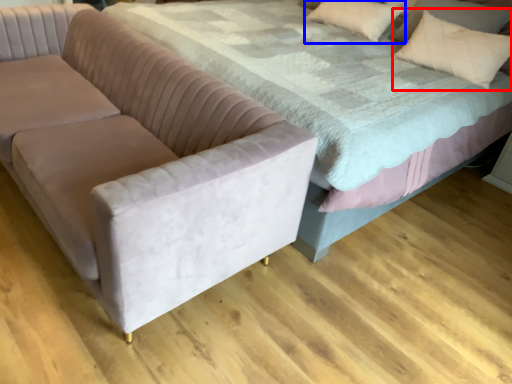
Question: Which of the following is the farthest to the observer, throw pillow (highlighted by a red box) or pillow (highlighted by a blue box)?

Choices:
 (A) throw pillow
 (B) pillow

Answer: (B)